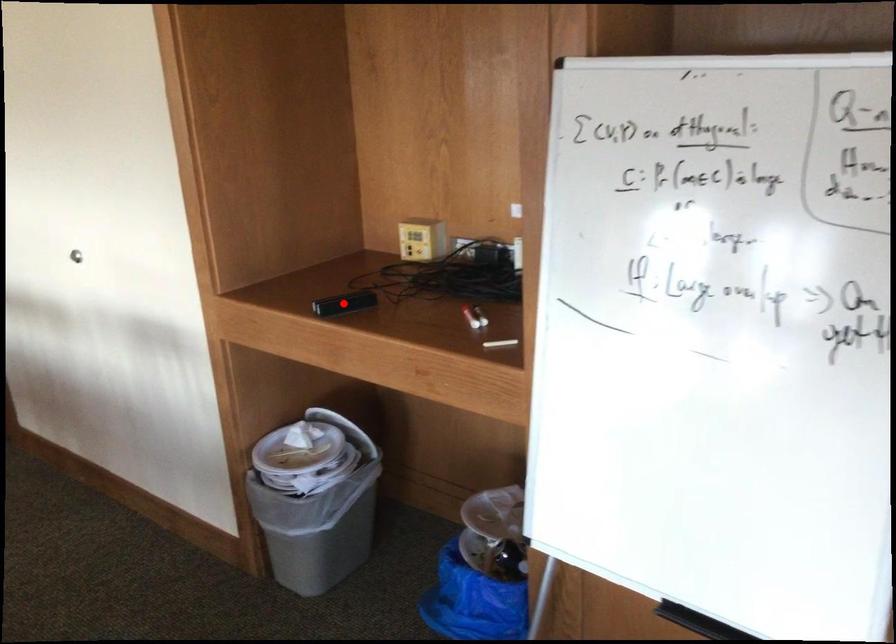
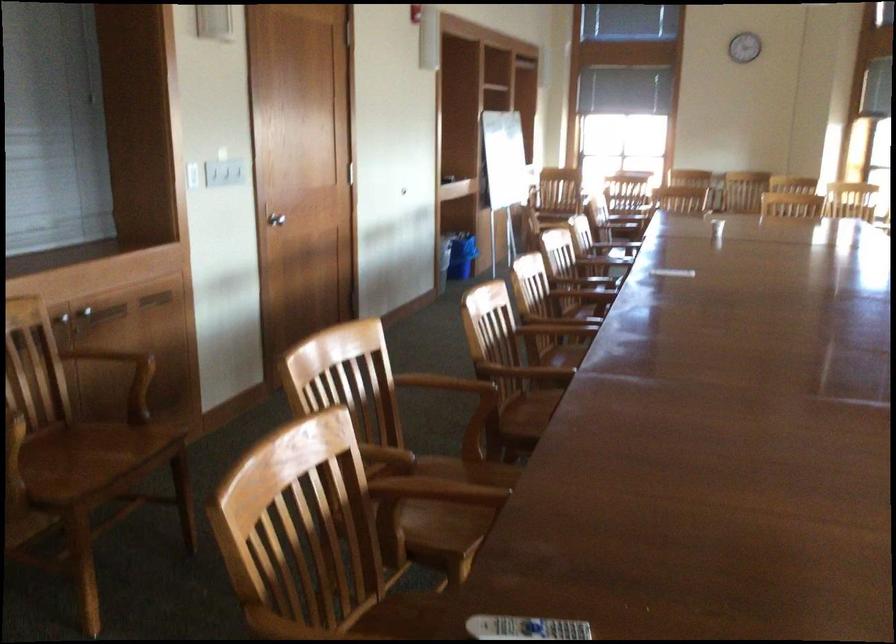
Question: I am providing you with two images of the same scene from different viewpoints. A red point is marked on the first image. Can you still see the location of the red point in image 2?

Choices:
 (A) Yes
 (B) No

Answer: (B)